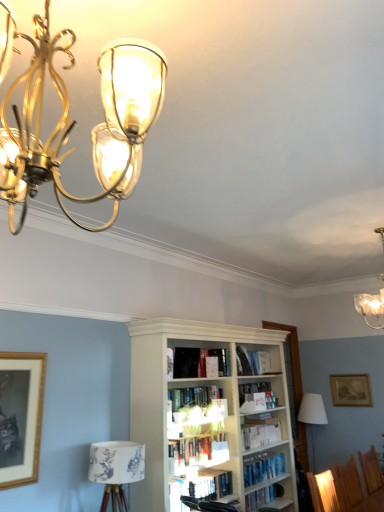
Describe the element at coordinates (207, 504) in the screenshot. I see `black leather swivel chair at center` at that location.

What is the approximate height of white fabric lampshade at right?

white fabric lampshade at right is 1.12 meters tall.

Image resolution: width=384 pixels, height=512 pixels. I want to click on wooden framed print at lower left, the second picture frame from the right, so click(x=20, y=416).

What is the approximate width of hardcover books at center, the second book viewed from the top?

hardcover books at center, the second book viewed from the top, is 5.35 inches in width.

Locate an element on the screen. The height and width of the screenshot is (512, 384). white paper book at center, which is counted as the 4th book, starting from the top is located at coordinates pos(260,435).

From a real-world perspective, who is located higher, hardcover book at center, placed as the 1th book when sorted from top to bottom, or white wooden bookshelf at lower center?

From a 3D spatial view, hardcover book at center, placed as the 1th book when sorted from top to bottom, is above.

Considering the positions of point (243, 357) and point (276, 504), is point (243, 357) closer or farther from the camera than point (276, 504)?

Point (243, 357) appears to be farther away from the viewer than point (276, 504).

Considering the sizes of objects hardcover book at center, the 5th book when ordered from bottom to top, and white wooden bookshelf at lower center in the image provided, who is shorter, hardcover book at center, the 5th book when ordered from bottom to top, or white wooden bookshelf at lower center?

white wooden bookshelf at lower center.

Which object is closer to the camera, translucent glass chandelier at upper right, placed as the first lamp when sorted from back to front, or black leather swivel chair at center?

Positioned in front is translucent glass chandelier at upper right, placed as the first lamp when sorted from back to front.

Which is more to the right, translucent glass chandelier at upper right, placed as the first lamp when sorted from back to front, or black leather swivel chair at center?

Positioned to the right is translucent glass chandelier at upper right, placed as the first lamp when sorted from back to front.

Who is smaller, translucent glass chandelier at upper right, placed as the first lamp when sorted from back to front, or black leather swivel chair at center?

black leather swivel chair at center is smaller.

Is translucent glass chandelier at upper right, marked as the second lamp in a left-to-right arrangement, outside of black leather swivel chair at center?

translucent glass chandelier at upper right, marked as the second lamp in a left-to-right arrangement, lies outside black leather swivel chair at center's area.

Between wooden picture frame at upper right, the 2th picture frame from the left, and hardcover books at center, arranged as the 3th book when viewed from the top, which one has larger size?

hardcover books at center, arranged as the 3th book when viewed from the top.

From a real-world perspective, does wooden picture frame at upper right, the 2th picture frame from the left, stand above hardcover books at center, which is the third book from bottom to top?

Yes, from a real-world perspective, wooden picture frame at upper right, the 2th picture frame from the left, is over hardcover books at center, which is the third book from bottom to top

Considering the points (346, 391) and (199, 454), which point is in front, point (346, 391) or point (199, 454)?

The point (199, 454) is closer.

How many degrees apart are the facing directions of wooden picture frame at upper right, placed as the first picture frame when sorted from back to front, and hardcover books at center, which is the third book from bottom to top?

89.6 degrees separate the facing orientations of wooden picture frame at upper right, placed as the first picture frame when sorted from back to front, and hardcover books at center, which is the third book from bottom to top.

Does wooden framed print at lower left, which appears as the second picture frame when ordered from the bottom, have a smaller size compared to hardcover books at center, placed as the fourth book when sorted from bottom to top?

Yes.

Which is closer, [17,412] or [175,411]?

Point [17,412] appears to be closer to the viewer than point [175,411].

From the picture: Considering the relative sizes of wooden framed print at lower left, which is the 2th picture frame from back to front, and hardcover books at center, the second book viewed from the top, in the image provided, is wooden framed print at lower left, which is the 2th picture frame from back to front, wider than hardcover books at center, the second book viewed from the top,?

No.

Considering the sizes of objects translucent glass chandelier at upper right, placed as the first lamp when sorted from back to front, and wooden framed print at lower left, the second picture frame from the right, in the image provided, who is wider, translucent glass chandelier at upper right, placed as the first lamp when sorted from back to front, or wooden framed print at lower left, the second picture frame from the right,?

With larger width is translucent glass chandelier at upper right, placed as the first lamp when sorted from back to front.

Is translucent glass chandelier at upper right, placed as the first lamp when sorted from back to front, bigger than wooden framed print at lower left, which appears as the second picture frame when ordered from the bottom?

Indeed, translucent glass chandelier at upper right, placed as the first lamp when sorted from back to front, has a larger size compared to wooden framed print at lower left, which appears as the second picture frame when ordered from the bottom.

Is translucent glass chandelier at upper right, positioned as the 1th lamp in right-to-left order, facing towards wooden framed print at lower left, which appears as the first picture frame when viewed from the front?

No, translucent glass chandelier at upper right, positioned as the 1th lamp in right-to-left order, is not oriented towards wooden framed print at lower left, which appears as the first picture frame when viewed from the front.

From a real-world perspective, between translucent glass chandelier at upper right, marked as the second lamp in a left-to-right arrangement, and wooden framed print at lower left, the second picture frame from the right, who is vertically lower?

wooden framed print at lower left, the second picture frame from the right.

Considering the relative positions of hardcover books at center, arranged as the 3th book when viewed from the top, and hardcover books at center, placed as the fourth book when sorted from bottom to top, in the image provided, is hardcover books at center, arranged as the 3th book when viewed from the top, to the left or to the right of hardcover books at center, placed as the fourth book when sorted from bottom to top,?

In the image, hardcover books at center, arranged as the 3th book when viewed from the top, appears on the right side of hardcover books at center, placed as the fourth book when sorted from bottom to top.

Is hardcover books at center, arranged as the 3th book when viewed from the top, thinner than hardcover books at center, placed as the fourth book when sorted from bottom to top?

Correct, the width of hardcover books at center, arranged as the 3th book when viewed from the top, is less than that of hardcover books at center, placed as the fourth book when sorted from bottom to top.

Are hardcover books at center, arranged as the 3th book when viewed from the top, and hardcover books at center, placed as the fourth book when sorted from bottom to top, located far from each other?

No, hardcover books at center, arranged as the 3th book when viewed from the top, is not far from hardcover books at center, placed as the fourth book when sorted from bottom to top.

Relative to gold metallic chandelier at upper left, the 1th lamp when ordered from front to back, is hardcover books at center, placed as the fourth book when sorted from bottom to top, in front or behind?

Clearly, hardcover books at center, placed as the fourth book when sorted from bottom to top, is behind gold metallic chandelier at upper left, the 1th lamp when ordered from front to back.

From the image's perspective, is hardcover books at center, placed as the fourth book when sorted from bottom to top, located beneath gold metallic chandelier at upper left, which ranks as the second lamp in right-to-left order?

Yes, from the image's perspective, hardcover books at center, placed as the fourth book when sorted from bottom to top, is below gold metallic chandelier at upper left, which ranks as the second lamp in right-to-left order.

Can you see hardcover books at center, placed as the fourth book when sorted from bottom to top, touching gold metallic chandelier at upper left, which is counted as the 1th lamp, starting from the left?

No, hardcover books at center, placed as the fourth book when sorted from bottom to top, is not making contact with gold metallic chandelier at upper left, which is counted as the 1th lamp, starting from the left.

Is point (208, 392) closer to camera compared to point (41, 147)?

No, it is behind (41, 147).

In the image, there is a hardcover book at center, placed as the 1th book when sorted from top to bottom. Find the location of `shelf below it (from the image's perspective)`. shelf below it (from the image's perspective) is located at coordinates (267, 498).

Locate an element on the screen. This screenshot has height=512, width=384. lamp on the right of black leather swivel chair at center is located at coordinates (371, 307).

When comparing their distances from wooden picture frame at upper right, the 2th picture frame from the left, does translucent glass chandelier at upper right, placed as the first lamp when sorted from back to front, or hardcover books at center, the second book viewed from the top, seem closer?

translucent glass chandelier at upper right, placed as the first lamp when sorted from back to front, is positioned closer to the anchor wooden picture frame at upper right, the 2th picture frame from the left.

Looking at the image, which one is located further to hardcover books at center, arranged as the 3th book when viewed from the top, white paper book at center, which ranks as the second book in bottom-to-top order, or white fabric lampshade at right?

white fabric lampshade at right is positioned further to the anchor hardcover books at center, arranged as the 3th book when viewed from the top.

When comparing their distances from hardcover books at center, placed as the fourth book when sorted from bottom to top, does wooden framed print at lower left, which appears as the second picture frame when ordered from the bottom, or hardcover book at center, acting as the fifth book starting from the top, seem further?

Among the two, wooden framed print at lower left, which appears as the second picture frame when ordered from the bottom, is located further to hardcover books at center, placed as the fourth book when sorted from bottom to top.

Which object lies further to the anchor point hardcover book at center, acting as the fifth book starting from the top, hardcover books at center, the second book viewed from the top, or white wooden bookshelf at lower center?

white wooden bookshelf at lower center lies further to hardcover book at center, acting as the fifth book starting from the top, than the other object.

Which object lies nearer to the anchor point white fabric lampshade at right, gold metallic chandelier at upper left, which is counted as the 2th lamp, starting from the back, or white paper book at center, which ranks as the second book in bottom-to-top order?

Based on the image, white paper book at center, which ranks as the second book in bottom-to-top order, appears to be nearer to white fabric lampshade at right.

Estimate the real-world distances between objects in this image. Which object is closer to gold metallic chandelier at upper left, which ranks as the second lamp in right-to-left order, hardcover book at center, the 5th book when ordered from bottom to top, or white wooden bookshelf at lower center?

Among the two, hardcover book at center, the 5th book when ordered from bottom to top, is located nearer to gold metallic chandelier at upper left, which ranks as the second lamp in right-to-left order.

From the image, which object appears to be farther from hardcover book at center, acting as the fifth book starting from the top, white fabric lampshade at right or translucent glass chandelier at upper right, positioned as the 1th lamp in right-to-left order?

translucent glass chandelier at upper right, positioned as the 1th lamp in right-to-left order, lies further to hardcover book at center, acting as the fifth book starting from the top, than the other object.

In the scene shown: Based on their spatial positions, is hardcover books at center, the second book viewed from the top, or translucent glass chandelier at upper right, marked as the second lamp in a left-to-right arrangement, closer to wooden framed print at lower left, which appears as the second picture frame when ordered from the bottom?

The object closer to wooden framed print at lower left, which appears as the second picture frame when ordered from the bottom, is hardcover books at center, the second book viewed from the top.

Where is `shelf between hardcover books at center, which is the third book from bottom to top, and wooden picture frame at upper right, the first picture frame when ordered from bottom to top, from front to back`? The width and height of the screenshot is (384, 512). shelf between hardcover books at center, which is the third book from bottom to top, and wooden picture frame at upper right, the first picture frame when ordered from bottom to top, from front to back is located at coordinates (267, 498).

Locate an element on the screen. swivel chair between gold metallic chandelier at upper left, the 1th lamp when ordered from front to back, and wooden picture frame at upper right, which is counted as the 2th picture frame, starting from the front, in the front-back direction is located at coordinates (207, 504).

Where is `swivel chair between translucent glass chandelier at upper right, placed as the first lamp when sorted from back to front, and white fabric lampshade at right in the up-down direction`? swivel chair between translucent glass chandelier at upper right, placed as the first lamp when sorted from back to front, and white fabric lampshade at right in the up-down direction is located at coordinates (207, 504).

Where is `picture frame between gold metallic chandelier at upper left, which is counted as the 2th lamp, starting from the back, and wooden picture frame at upper right, the 2th picture frame viewed from the top, in the front-back direction`? picture frame between gold metallic chandelier at upper left, which is counted as the 2th lamp, starting from the back, and wooden picture frame at upper right, the 2th picture frame viewed from the top, in the front-back direction is located at coordinates (20, 416).